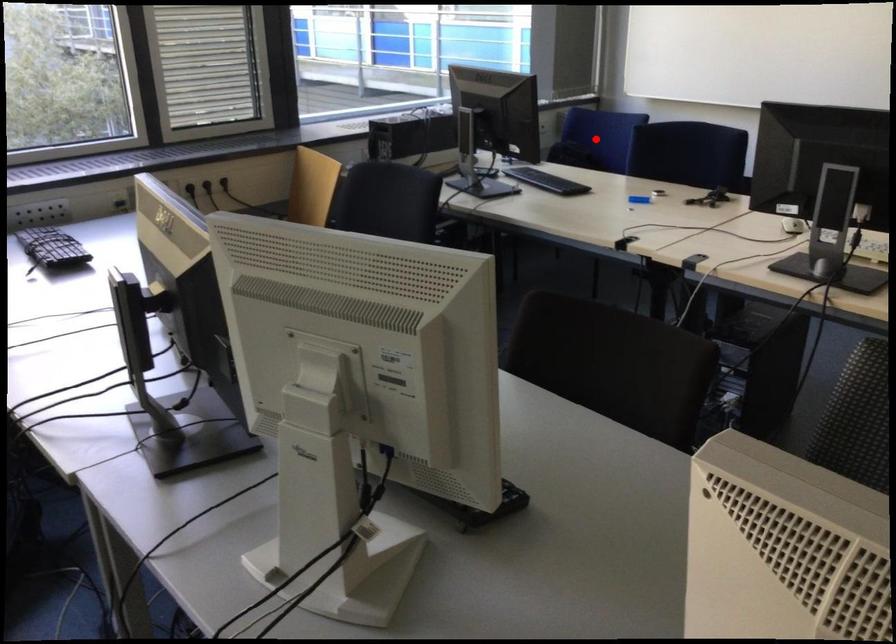
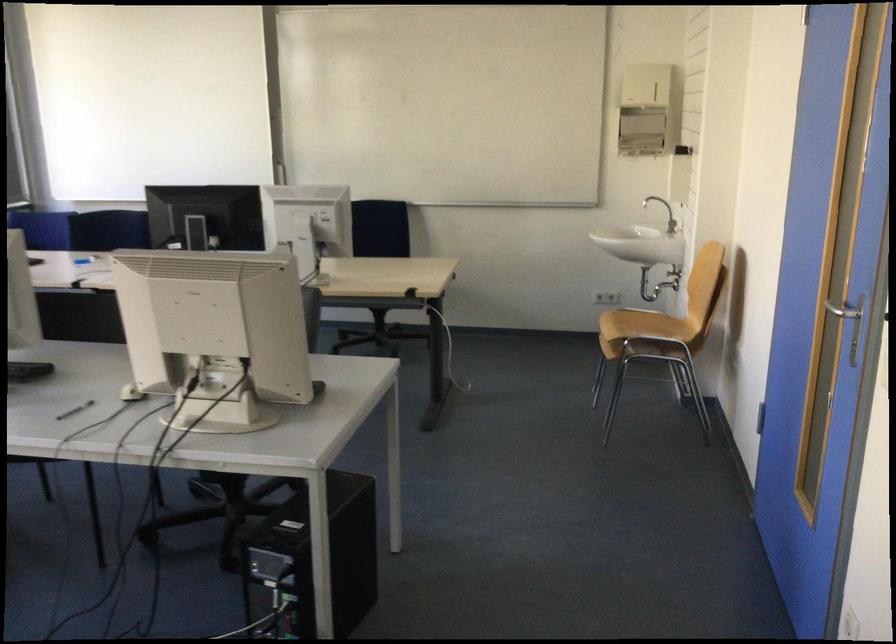
Question: I am providing you with two images of the same scene from different viewpoints. A red point is marked on the first image. Is the red point's position out of view in image 2?

Choices:
 (A) Yes
 (B) No

Answer: (A)